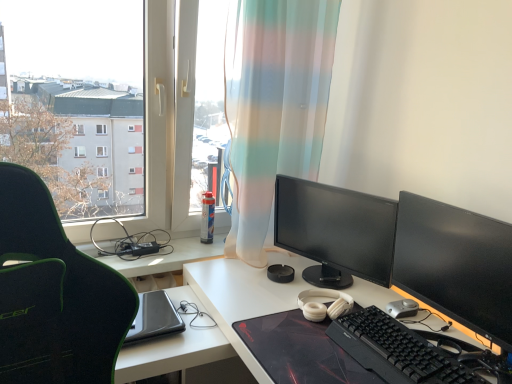
Locate an element on the screen. The width and height of the screenshot is (512, 384). vacant location behind white matte headphones at center is located at coordinates (317, 282).